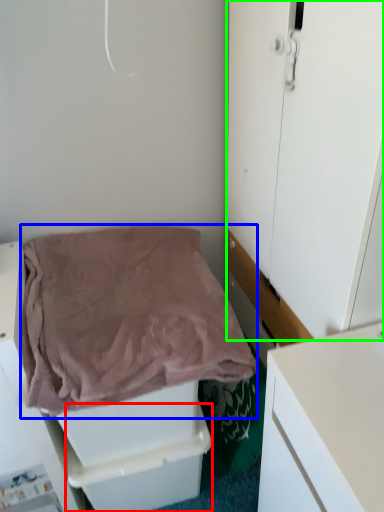
Question: Based on their relative distances, which object is nearer to drawer (highlighted by a red box)? Choose from blanket (highlighted by a blue box) and door (highlighted by a green box).

Choices:
 (A) blanket
 (B) door

Answer: (A)